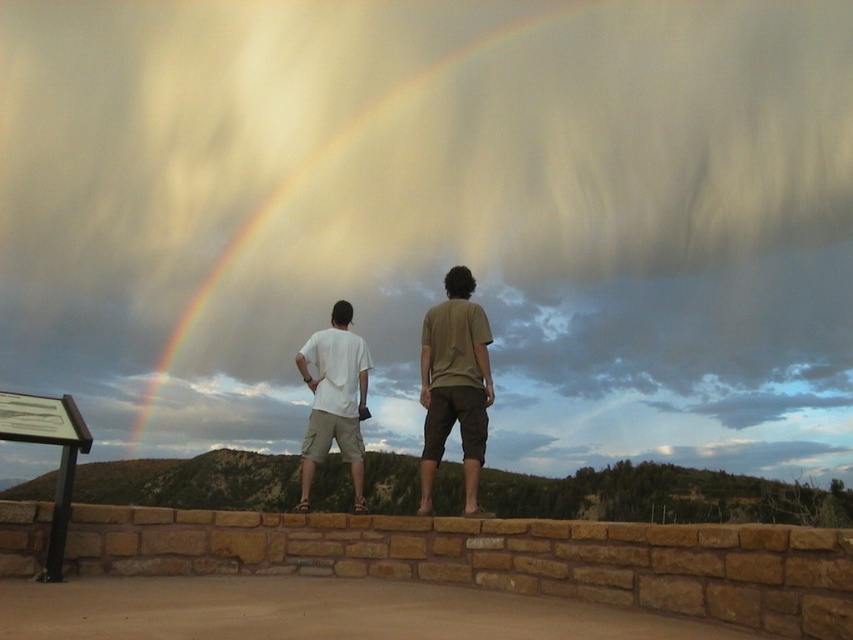
Is matte white t-shirt at center smaller than white cotton t-shirt at center?

No.

Identify the location of matte white t-shirt at center. (456, 385).

What do you see at coordinates (456, 385) in the screenshot? I see `matte white t-shirt at center` at bounding box center [456, 385].

I want to click on matte white t-shirt at center, so click(456, 385).

Does point (260, 516) come in front of point (427, 422)?

Yes, point (260, 516) is closer to viewer.

Is brown stone ledge at center above matte white t-shirt at center?

No.

Is point (788, 579) more distant than point (477, 381)?

No, it is in front of (477, 381).

This screenshot has height=640, width=853. I want to click on brown stone ledge at center, so click(x=500, y=557).

Does brown stone ledge at center appear on the right side of white cotton t-shirt at center?

Correct, you'll find brown stone ledge at center to the right of white cotton t-shirt at center.

Does brown stone ledge at center appear over white cotton t-shirt at center?

No.

Where is `brown stone ledge at center`? This screenshot has height=640, width=853. brown stone ledge at center is located at coordinates (500, 557).